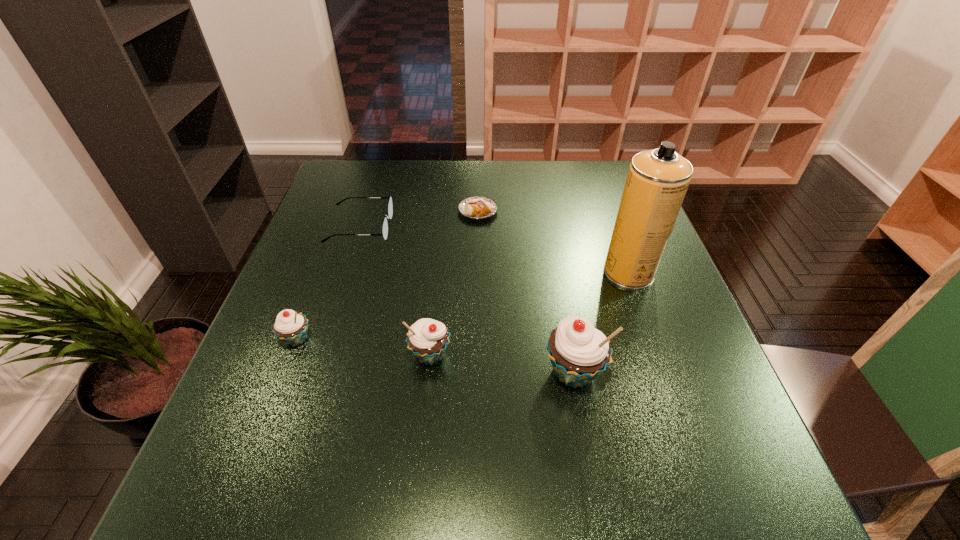
You are a GUI agent. You are given a task and a screenshot of the screen. Output one action in this format:
    pyautogui.click(x=<x>, y=<y>)
    Task: Click on the vacant place for an extra cupcake on the right
    This screenshot has height=540, width=960.
    Given the screenshot: What is the action you would take?
    pyautogui.click(x=726, y=390)